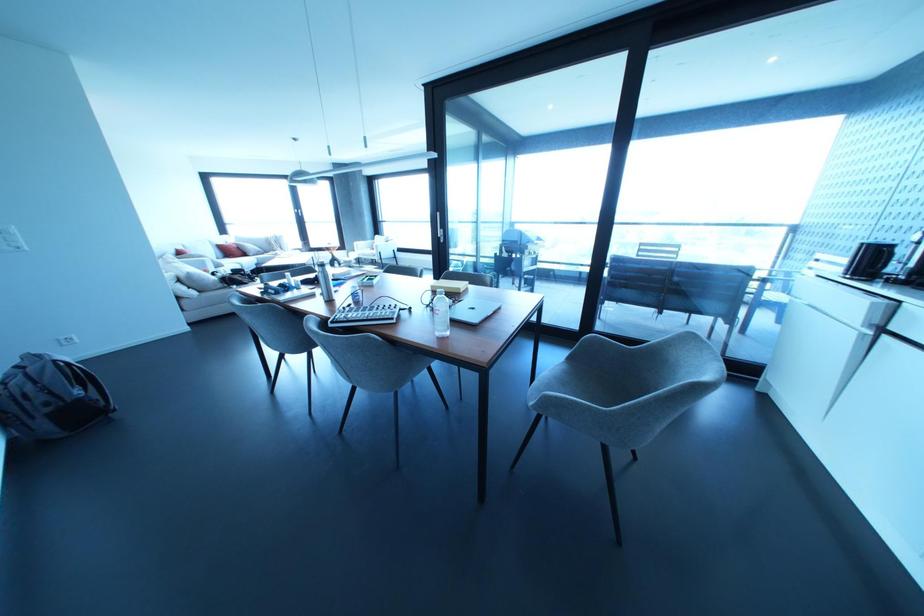
The width and height of the screenshot is (924, 616). What do you see at coordinates (220, 252) in the screenshot?
I see `a white sofa sitting surface` at bounding box center [220, 252].